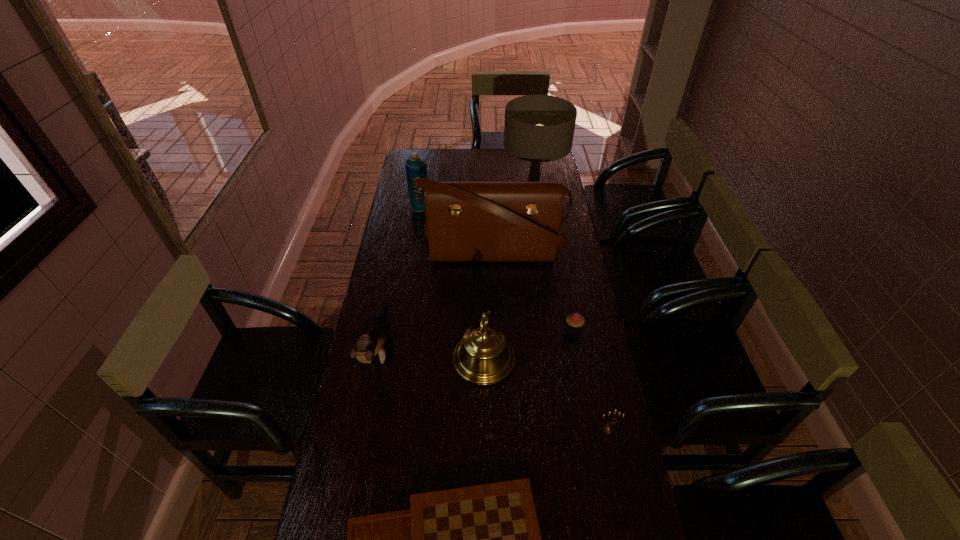
Where is `lampshade`? This screenshot has width=960, height=540. lampshade is located at coordinates (539, 128).

This screenshot has height=540, width=960. In order to click on satchel in this screenshot , I will do `click(465, 221)`.

You are a GUI agent. You are given a task and a screenshot of the screen. Output one action in this format:
    pyautogui.click(x=<x>, y=<y>)
    Task: Click on the sixth shortest object
    This screenshot has height=540, width=960.
    Given the screenshot: What is the action you would take?
    pyautogui.click(x=416, y=167)

The height and width of the screenshot is (540, 960). In order to click on bell in this screenshot , I will do `click(483, 357)`.

Identify the location of the fourth shortest object. (375, 331).

Find the location of a particular element. candelabrum is located at coordinates (607, 427).

Find the location of a particular element. The height and width of the screenshot is (540, 960). the second nearest object is located at coordinates (607, 427).

You are a GUI agent. You are given a task and a screenshot of the screen. Output one action in this format:
    pyautogui.click(x=<x>, y=<y>)
    Task: Click on the cupcake
    Image resolution: width=960 pixels, height=540 pixels.
    Given the screenshot: What is the action you would take?
    pyautogui.click(x=574, y=321)

I want to click on blank area located on the front-facing side of the lampshade, so click(477, 192).

What are the coordinates of `free point located on the front-facing side of the lampshade` in the screenshot? It's located at (466, 192).